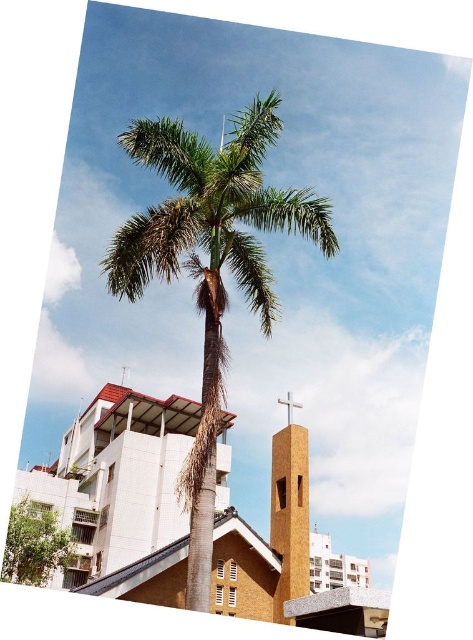
In the scene shown: You are an architect designing a new building. You want to ensure that the building does not block the view of the metallic cross at center from the green leafy tree at lower left. Based on their heights, is this feasible?

The green leafy tree at lower left is taller than the metallic cross at center. Since the tree is taller, it would likely block the view of the cross from its position, making it challenging to ensure an unobstructed view of the metallic cross at center from the green leafy tree at lower left.

You are standing at the base of the palm tree and want to walk towards the point labeled point (291, 474). However, there is an obstacle at point (291, 400). Will you encounter the obstacle before reaching your destination?

Yes, you will encounter the obstacle at point (291, 400) before reaching point (291, 474) because point (291, 474) is in front of point (291, 400), meaning the obstacle is closer to your starting position.

You are standing at the center of the image. Which direction should you look to see the green leafy tree at lower left?

The green leafy tree at lower left is located at point (x=35, y=545), so you should look to the lower left direction to see it.